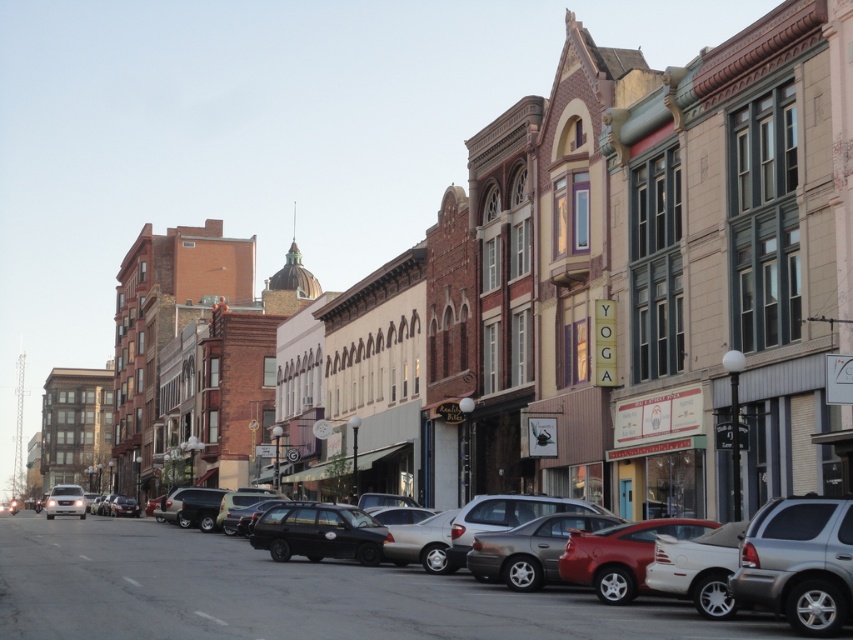
You are a delivery driver needing to park your vehicle in this street. You see the black matte sedan at center and the silver metallic suv at lower right. Which vehicle is closer to the left side of the street?

The black matte sedan at center is closer to the left side of the street because it is positioned to the left of the silver metallic suv at lower right.

Looking at this image, you are a pedestrian standing at the edge of the street. You see a silver metallic suv at lower right and a shiny red car at center. Which vehicle is positioned higher relative to the other?

The silver metallic suv at lower right is located above the shiny red car at center, so it is positioned higher.